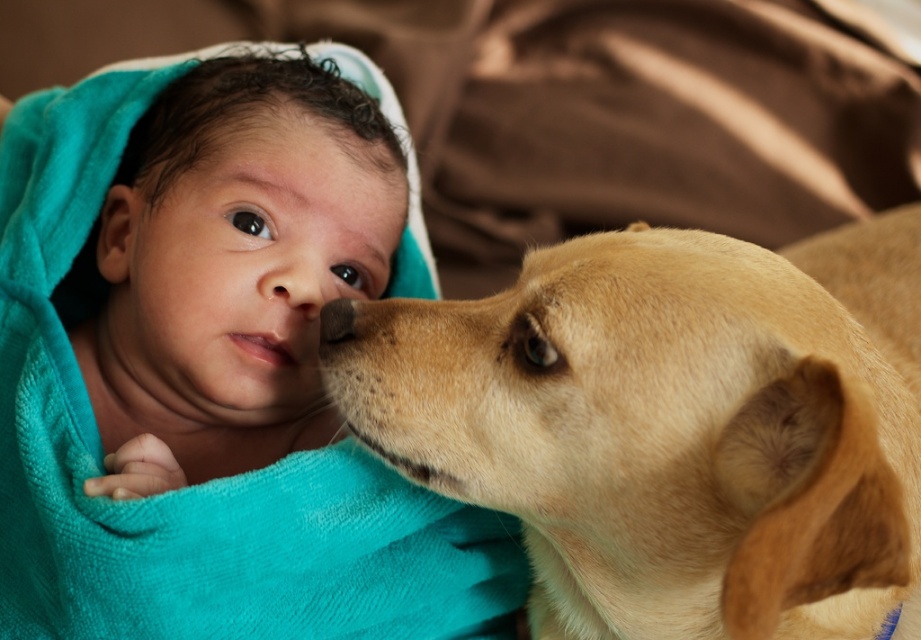
Looking at this image, you are a photographer trying to capture the baby and the dog in the image. The baby is on a soft surface, and the dog is to the right of the baby. There is a point marked at coordinates [671,426]. What does this point indicate about the dog?

The point at coordinates [671,426] marks the location of the light brown fur dog at center in the image.

You are a photographer setting up for a family photo. The light brown fur dog at center and the turquoise towel wrapped baby at center are positioned 11.22 inches apart. You need to ensure that both subjects are in focus. Given that your camera has a depth of field that can sharply focus on objects within a 10 inch range, will both subjects be in focus?

The distance between the light brown fur dog at center and the turquoise towel wrapped baby at center is 11.22 inches. Since the camera can only sharply focus within a 10 inch range, the subjects are slightly beyond the depth of field. Therefore, both subjects might not be in focus simultaneously.

You are a photographer taking a closeup shot of the baby and the dog. The camera has a depth of field that can focus clearly on objects within 10 inches. Can both the turquoise towel wrapped baby at center and the smooth beige nose at center be in focus at the same time?

The distance between the turquoise towel wrapped baby at center and the smooth beige nose at center is 9.95 inches, which is within the camera depth of field range of 10 inches. Therefore, both the turquoise towel wrapped baby at center and the smooth beige nose at center can be in focus simultaneously.